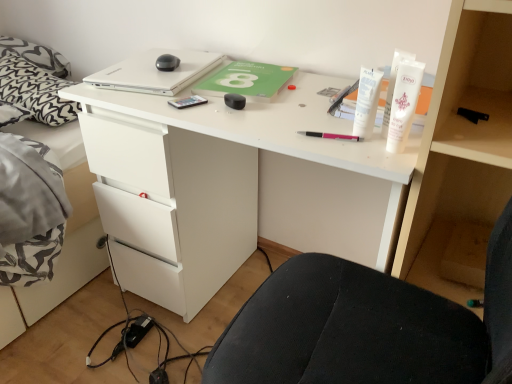
The height and width of the screenshot is (384, 512). Find the location of `free space between white matte tube at upper right, the second toiletry viewed from the right, and black rubberized mouse at center, the 2th stationery in the left-to-right sequence`. free space between white matte tube at upper right, the second toiletry viewed from the right, and black rubberized mouse at center, the 2th stationery in the left-to-right sequence is located at coordinates (287, 117).